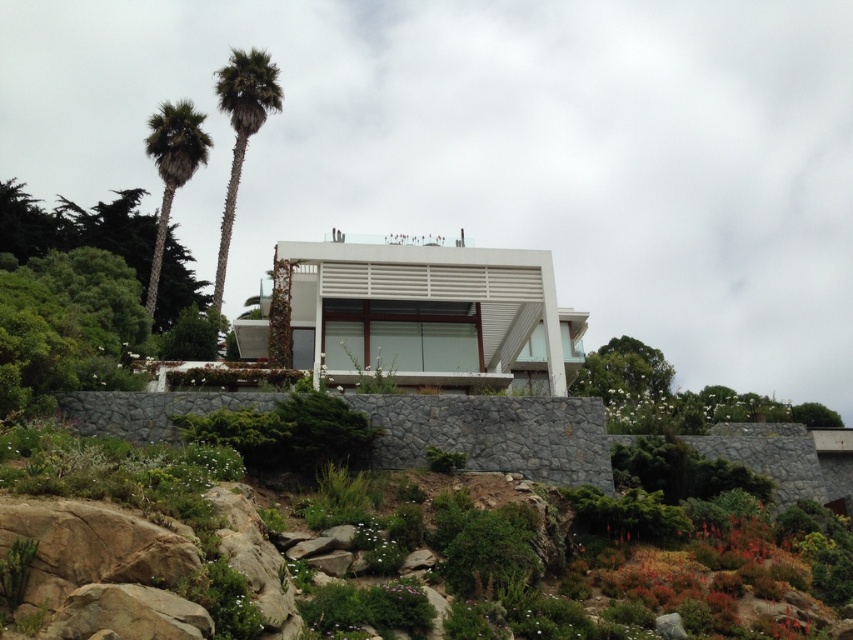
Question: Which of the following is the closest to the observer?

Choices:
 (A) green leafy palm tree at left
 (B) green leafy palm tree at upper left

Answer: (A)

Question: Is green leafy palm tree at upper left bigger than green leafy palm tree at left?

Choices:
 (A) yes
 (B) no

Answer: (A)

Question: Is green leafy palm tree at upper left smaller than green leafy palm tree at left?

Choices:
 (A) no
 (B) yes

Answer: (A)

Question: Does green leafy palm tree at upper left lie behind green leafy palm tree at left?

Choices:
 (A) yes
 (B) no

Answer: (A)

Question: Which object is closer to the camera taking this photo?

Choices:
 (A) green leafy palm tree at upper left
 (B) green leafy palm tree at left

Answer: (B)